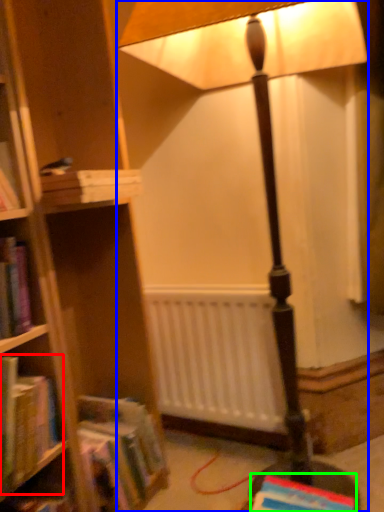
Question: Which is nearer to the book (highlighted by a red box)? lamp (highlighted by a blue box) or book (highlighted by a green box).

Choices:
 (A) lamp
 (B) book

Answer: (B)